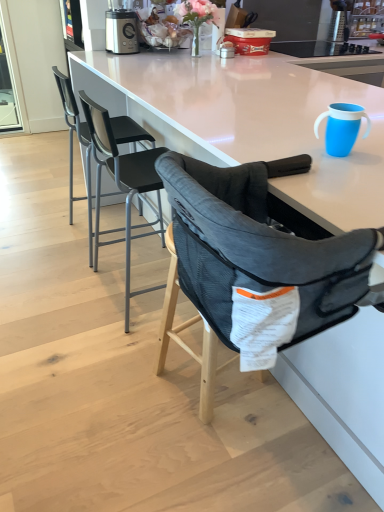
Locate an element on the screen. This screenshot has height=512, width=384. free space that is in between black mesh chair at center, the second chair in the back-to-front sequence, and black mesh chair at upper left, placed as the 3th chair when sorted from front to back is located at coordinates (116, 263).